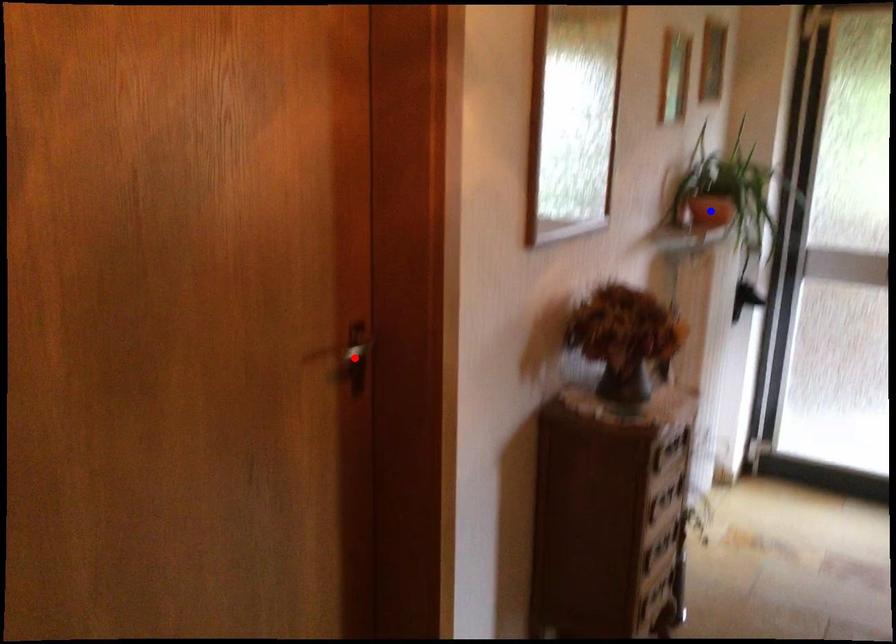
Question: Two points are marked on the image. Which point is closer to the camera?

Choices:
 (A) Blue point is closer.
 (B) Red point is closer.

Answer: (B)